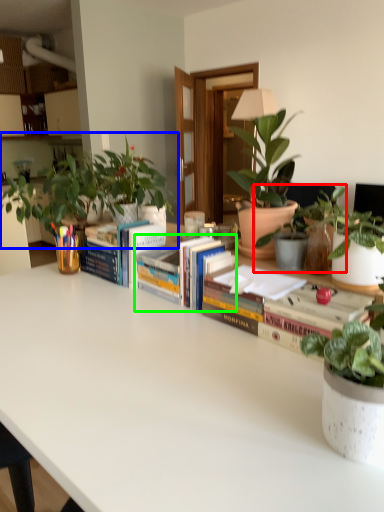
Question: Which is farther away from houseplant (highlighted by a red box)? houseplant (highlighted by a blue box) or book (highlighted by a green box)?

Choices:
 (A) houseplant
 (B) book

Answer: (A)